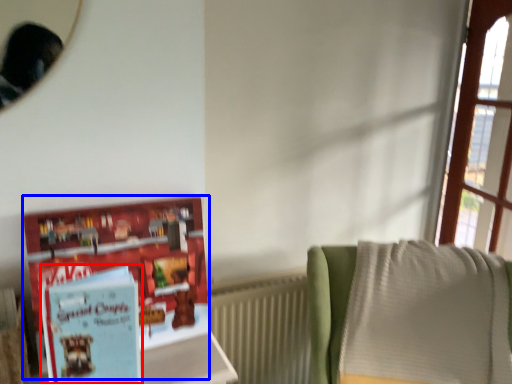
Question: Which of the following is the farthest to the observer, paperback book (highlighted by a red box) or book (highlighted by a blue box)?

Choices:
 (A) paperback book
 (B) book

Answer: (B)